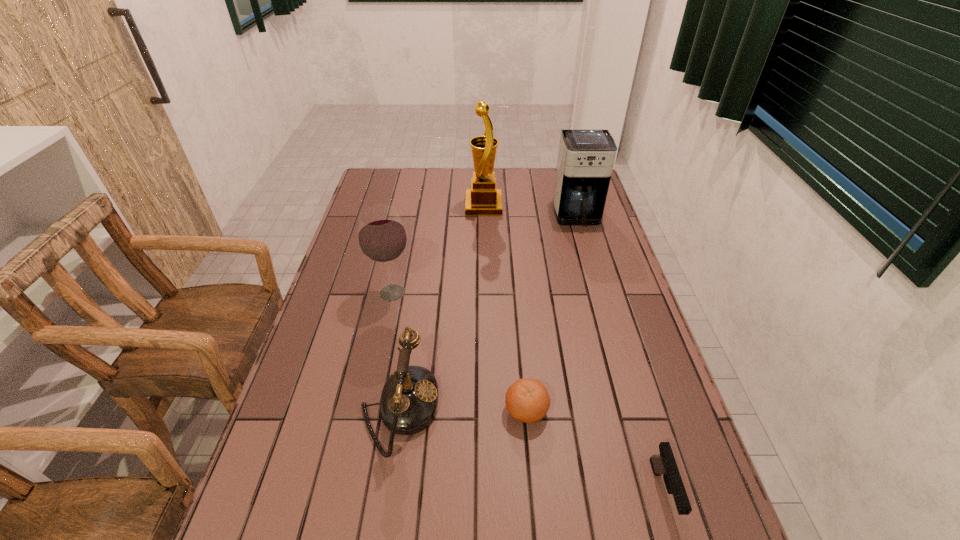
You are a GUI agent. You are given a task and a screenshot of the screen. Output one action in this format:
    pyautogui.click(x=<x>, y=<y>)
    Task: Click on the vacant space located 0.380m on the back of the fourth nearest object
    The height and width of the screenshot is (540, 960).
    Given the screenshot: What is the action you would take?
    410,211

Where is `free region located on the dial of the fourth tallest object`? The image size is (960, 540). free region located on the dial of the fourth tallest object is located at coordinates (603, 409).

Locate an element on the screen. Image resolution: width=960 pixels, height=540 pixels. free space located 0.240m on the back of the clementine is located at coordinates (518, 319).

The width and height of the screenshot is (960, 540). I want to click on object that is at the far edge, so click(483, 199).

Locate an element on the screen. The image size is (960, 540). object present at the left edge is located at coordinates (382, 238).

Find the location of a particular element. Image resolution: width=960 pixels, height=540 pixels. coffee maker at the right edge is located at coordinates (585, 161).

The image size is (960, 540). Find the location of `pistol that is at the right edge`. pistol that is at the right edge is located at coordinates (664, 464).

Where is `vacant space at the far edge of the desktop`? The image size is (960, 540). vacant space at the far edge of the desktop is located at coordinates (431, 171).

The image size is (960, 540). I want to click on vacant space at the left edge of the desktop, so click(x=364, y=306).

Locate an element on the screen. vacant space at the right edge of the desktop is located at coordinates (638, 308).